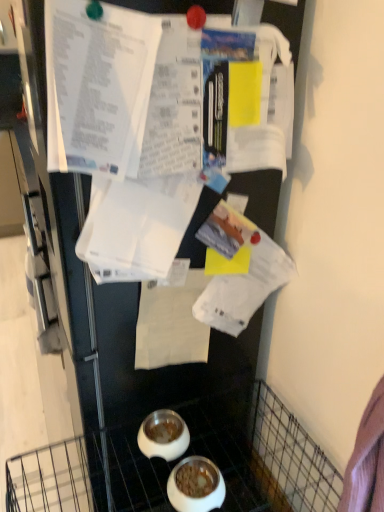
Question: Are white paper at center and white glossy bowl at lower center, the 2th bowl from the front, beside each other?

Choices:
 (A) yes
 (B) no

Answer: (B)

Question: From the image's perspective, is white paper at center on top of white glossy bowl at lower center, the 2th bowl from the front?

Choices:
 (A) yes
 (B) no

Answer: (A)

Question: From a real-world perspective, is white paper at center beneath white glossy bowl at lower center, the 2th bowl from the front?

Choices:
 (A) no
 (B) yes

Answer: (A)

Question: Considering the relative sizes of white paper at center and white glossy bowl at lower center, the 1th bowl when ordered from back to front, in the image provided, is white paper at center bigger than white glossy bowl at lower center, the 1th bowl when ordered from back to front,?

Choices:
 (A) no
 (B) yes

Answer: (B)

Question: Does white paper at center have a smaller size compared to white glossy bowl at lower center, the 1th bowl when ordered from back to front?

Choices:
 (A) yes
 (B) no

Answer: (B)

Question: Does white paper at center lie behind white glossy bowl at lower center, the 1th bowl when ordered from back to front?

Choices:
 (A) yes
 (B) no

Answer: (B)

Question: Does white glossy bowl at lower center, which ranks as the first bowl in front-to-back order, appear on the left side of white paper at center?

Choices:
 (A) yes
 (B) no

Answer: (B)

Question: Are white glossy bowl at lower center, which ranks as the first bowl in front-to-back order, and white paper at center making contact?

Choices:
 (A) no
 (B) yes

Answer: (A)

Question: From a real-world perspective, is white glossy bowl at lower center, arranged as the 2th bowl when viewed from the back, located higher than white paper at center?

Choices:
 (A) yes
 (B) no

Answer: (B)

Question: Is white glossy bowl at lower center, which ranks as the first bowl in front-to-back order, facing towards white paper at center?

Choices:
 (A) no
 (B) yes

Answer: (A)

Question: Is white glossy bowl at lower center, arranged as the 2th bowl when viewed from the back, shorter than white paper at center?

Choices:
 (A) yes
 (B) no

Answer: (A)

Question: Is white glossy bowl at lower center, which ranks as the first bowl in front-to-back order, not near white paper at center?

Choices:
 (A) yes
 (B) no

Answer: (B)

Question: From the image's perspective, is white paper at center on white glossy bowl at lower center, which ranks as the first bowl in front-to-back order?

Choices:
 (A) no
 (B) yes

Answer: (B)